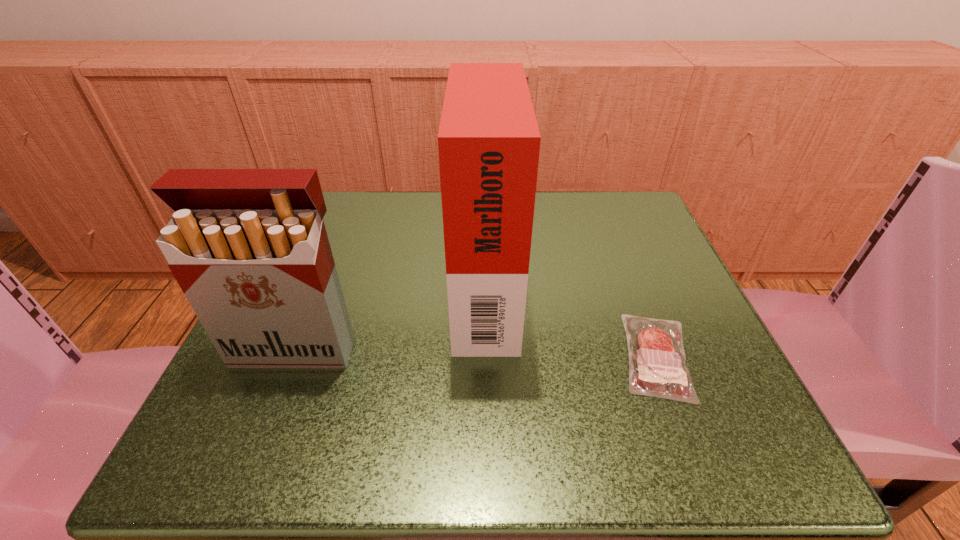
This screenshot has width=960, height=540. In the image, there is a desktop. What are the coordinates of `free space at the far left corner` in the screenshot? It's located at (359, 200).

This screenshot has width=960, height=540. Find the location of `free space at the far right corner`. free space at the far right corner is located at coordinates (628, 250).

Locate an element on the screen. vacant space at the near right corner of the desktop is located at coordinates (x=677, y=409).

You are a GUI agent. You are given a task and a screenshot of the screen. Output one action in this format:
    pyautogui.click(x=<x>, y=<y>)
    Task: Click on the free spot between the second object from left to right and the shorter cigarette case
    The image size is (960, 540).
    Given the screenshot: What is the action you would take?
    pyautogui.click(x=390, y=316)

You are a GUI agent. You are given a task and a screenshot of the screen. Output one action in this format:
    pyautogui.click(x=<x>, y=<y>)
    Task: Click on the free space between the tallest object and the shorter cigarette case
    The image size is (960, 540).
    Given the screenshot: What is the action you would take?
    pyautogui.click(x=390, y=316)

Locate an element on the screen. This screenshot has height=540, width=960. free space between the left cigarette case and the right cigarette case is located at coordinates (390, 316).

You are a GUI agent. You are given a task and a screenshot of the screen. Output one action in this format:
    pyautogui.click(x=<x>, y=<y>)
    Task: Click on the empty location between the second object from left to right and the rightmost object
    This screenshot has width=960, height=540.
    Given the screenshot: What is the action you would take?
    pyautogui.click(x=571, y=320)

Locate an element on the screen. Image resolution: width=960 pixels, height=540 pixels. vacant space that's between the taller cigarette case and the shorter cigarette case is located at coordinates (390, 316).

Find the location of a particular element. vacant point located between the leftmost object and the right cigarette case is located at coordinates (390, 316).

Locate an element on the screen. Image resolution: width=960 pixels, height=540 pixels. object that can be found as the closest to the steak is located at coordinates (488, 141).